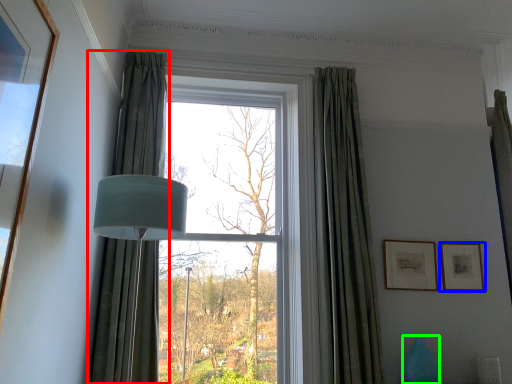
Question: Which is farther away from curtain (highlighted by a red box)? picture frame (highlighted by a blue box) or vase (highlighted by a green box)?

Choices:
 (A) picture frame
 (B) vase

Answer: (A)